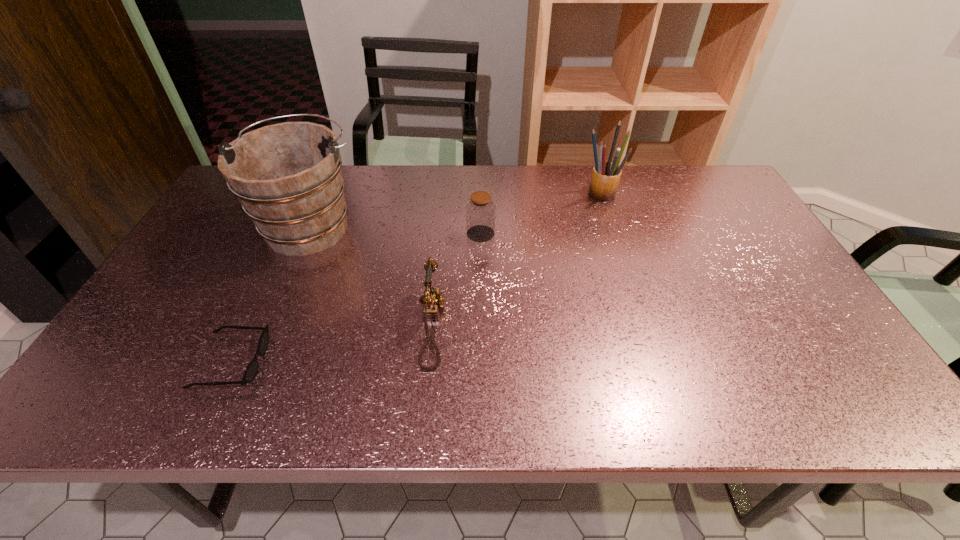
This screenshot has height=540, width=960. Find the location of `bucket`. bucket is located at coordinates (287, 176).

I want to click on pencil box, so click(x=605, y=178).

Image resolution: width=960 pixels, height=540 pixels. I want to click on the second tallest object, so (x=605, y=178).

Locate an element on the screen. jar is located at coordinates (480, 211).

Find the location of a particular element. The width and height of the screenshot is (960, 540). the third object from left to right is located at coordinates (433, 298).

You are a GUI agent. You are given a task and a screenshot of the screen. Output one action in this format:
    pyautogui.click(x=<x>, y=<y>)
    Task: Click on the shortest object
    This screenshot has height=540, width=960.
    Given the screenshot: What is the action you would take?
    pyautogui.click(x=252, y=368)

Find the location of `vacant area situated on the handle side of the tallest object`. vacant area situated on the handle side of the tallest object is located at coordinates (331, 180).

Locate an element on the screen. free space located on the handle side of the tallest object is located at coordinates (335, 170).

The height and width of the screenshot is (540, 960). Identify the location of vacant space situated 0.070m on the handle side of the tallest object. (330, 181).

What are the coordinates of `vacant area situated on the front of the rightmost object` in the screenshot? It's located at (623, 264).